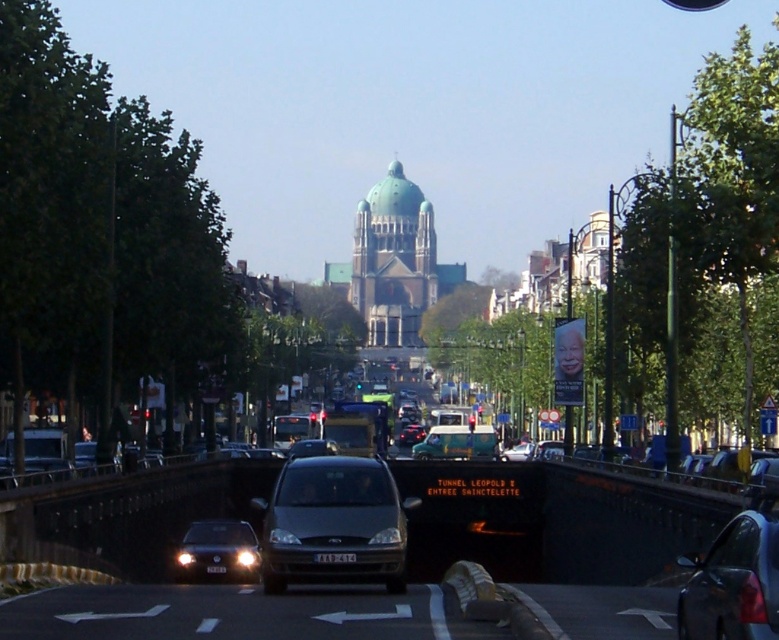
Is point (351, 456) more distant than point (221, 566)?

No, (351, 456) is in front of (221, 566).

Does matte gray van at center come behind black plastic license plate at center?

No, matte gray van at center is closer to the viewer.

Locate an element on the screen. matte gray van at center is located at coordinates (333, 524).

Is matte gray van at center shorter than matte black van at center?

Incorrect, matte gray van at center's height does not fall short of matte black van at center's.

Between matte gray van at center and matte black van at center, which one has less height?

Standing shorter between the two is matte black van at center.

The image size is (779, 640). Describe the element at coordinates (333, 524) in the screenshot. I see `matte gray van at center` at that location.

Image resolution: width=779 pixels, height=640 pixels. I want to click on matte gray van at center, so click(333, 524).

Who is shorter, matte gray van at center or white plastic license plate at center?

Standing shorter between the two is white plastic license plate at center.

Can you confirm if matte gray van at center is bigger than white plastic license plate at center?

Correct, matte gray van at center is larger in size than white plastic license plate at center.

Which is behind, point (351, 573) or point (351, 554)?

Point (351, 554)

The height and width of the screenshot is (640, 779). What are the coordinates of `matte gray van at center` in the screenshot? It's located at (333, 524).